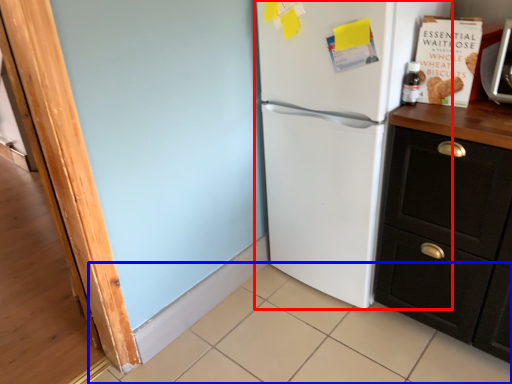
Question: Which point is closer to the camera, refrigerator (highlighted by a red box) or tile (highlighted by a blue box)?

Choices:
 (A) refrigerator
 (B) tile

Answer: (B)